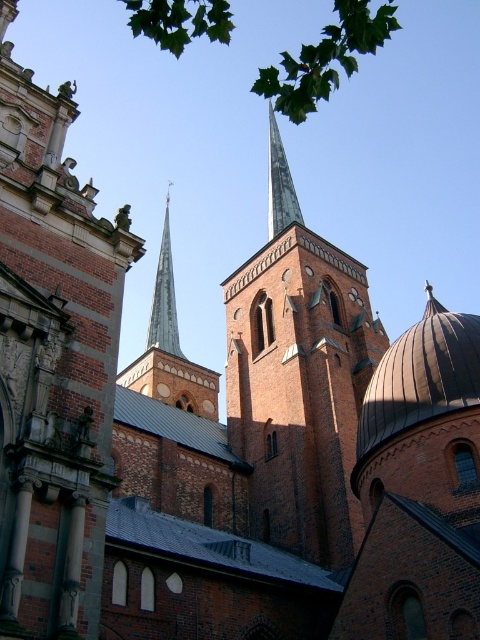
You are standing in front of the historic brick church and want to take a photo of both the brown stone tower at upper center and the brick steeple at center. However, you notice that one of them is blocking the view of the other. Which object is in front and might be obstructing the other?

The brown stone tower at upper center is in front of the brick steeple at center, so it might be obstructing the view of the brick steeple at center.

You are standing in front of the historic brick church and notice a green leafy tree in the image. Where exactly is the green leafy tree at upper center located in terms of coordinates?

The green leafy tree at upper center is located at coordinates point (325, 58).